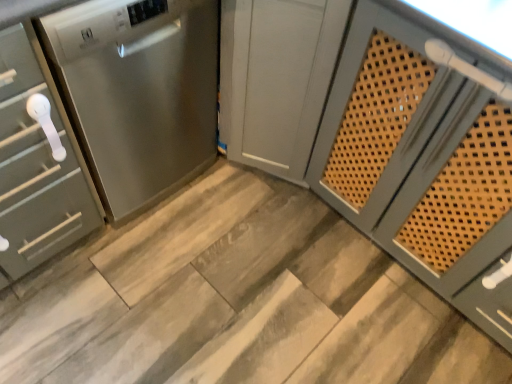
Question: Is stainless steel dishwasher at left taller or shorter than satin silver cabinet at left, which ranks as the 2th cabinetry in right-to-left order?

Choices:
 (A) tall
 (B) short

Answer: (B)

Question: Is stainless steel dishwasher at left bigger or smaller than satin silver cabinet at left, which is the 1th cabinetry in left-to-right order?

Choices:
 (A) small
 (B) big

Answer: (B)

Question: Which is nearer to the stainless steel dishwasher at left?

Choices:
 (A) satin silver cabinet at left, which is the 1th cabinetry in left-to-right order
 (B) satin gray cabinet at center, the second cabinetry when ordered from left to right
 (C) wooden at center

Answer: (A)

Question: Considering the real-world distances, which object is closest to the satin gray cabinet at center, the second cabinetry when ordered from left to right?

Choices:
 (A) stainless steel dishwasher at left
 (B) satin silver cabinet at left, which is the 1th cabinetry in left-to-right order
 (C) wooden at center

Answer: (A)